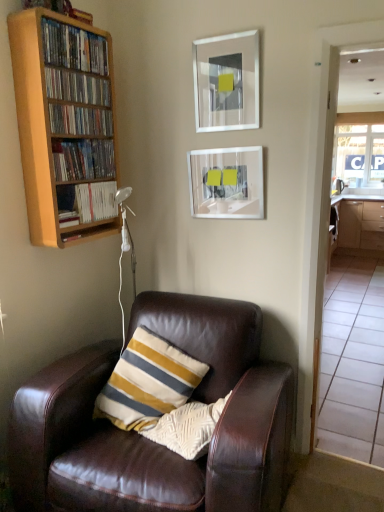
Question: Is wooden bookcase at left wider than brown leather chair at lower left?

Choices:
 (A) yes
 (B) no

Answer: (B)

Question: From a real-world perspective, is wooden bookcase at left positioned over brown leather chair at lower left based on gravity?

Choices:
 (A) no
 (B) yes

Answer: (B)

Question: Is there a large distance between wooden bookcase at left and brown leather chair at lower left?

Choices:
 (A) no
 (B) yes

Answer: (A)

Question: Can you confirm if wooden bookcase at left is bigger than brown leather chair at lower left?

Choices:
 (A) no
 (B) yes

Answer: (A)

Question: From a real-world perspective, is wooden bookcase at left beneath brown leather chair at lower left?

Choices:
 (A) no
 (B) yes

Answer: (A)

Question: Is wooden shelf at upper left, positioned as the fourth book in bottom-to-top order, inside the boundaries of brown leather chair at lower left, or outside?

Choices:
 (A) inside
 (B) outside

Answer: (B)

Question: Considering the positions of wooden shelf at upper left, positioned as the fourth book in bottom-to-top order, and brown leather chair at lower left in the image, is wooden shelf at upper left, positioned as the fourth book in bottom-to-top order, taller or shorter than brown leather chair at lower left?

Choices:
 (A) short
 (B) tall

Answer: (A)

Question: Considering the relative positions of wooden shelf at upper left, which is the 2th book from top to bottom, and brown leather chair at lower left in the image provided, is wooden shelf at upper left, which is the 2th book from top to bottom, to the left or to the right of brown leather chair at lower left?

Choices:
 (A) right
 (B) left

Answer: (B)

Question: From the image's perspective, is wooden shelf at upper left, which is the 2th book from top to bottom, positioned above or below brown leather chair at lower left?

Choices:
 (A) below
 (B) above

Answer: (B)

Question: Is transparent glass door at right inside or outside of wooden bookshelf at upper left, acting as the 5th book starting from the top?

Choices:
 (A) outside
 (B) inside

Answer: (A)

Question: Relative to wooden bookshelf at upper left, arranged as the first book when ordered from the bottom, is transparent glass door at right in front or behind?

Choices:
 (A) behind
 (B) front

Answer: (B)

Question: Is point (347, 125) positioned closer to the camera than point (82, 199)?

Choices:
 (A) farther
 (B) closer

Answer: (A)

Question: From their relative heights in the image, would you say transparent glass door at right is taller or shorter than wooden bookshelf at upper left, arranged as the first book when ordered from the bottom?

Choices:
 (A) short
 (B) tall

Answer: (B)

Question: From their relative heights in the image, would you say brown leather chair at lower left is taller or shorter than transparent glass window at right?

Choices:
 (A) short
 (B) tall

Answer: (A)

Question: Is point (228, 314) closer or farther from the camera than point (369, 173)?

Choices:
 (A) closer
 (B) farther

Answer: (A)